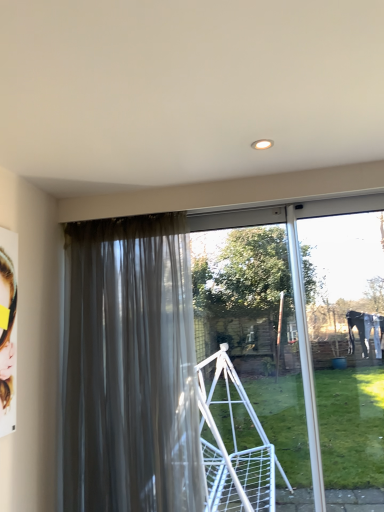
Question: Looking at their shapes, would you say satin gray curtain at left is wider or thinner than clear glass screen door at center?

Choices:
 (A) thin
 (B) wide

Answer: (B)

Question: Does point (134, 345) appear closer or farther from the camera than point (251, 239)?

Choices:
 (A) farther
 (B) closer

Answer: (B)

Question: Is satin gray curtain at left inside or outside of clear glass screen door at center?

Choices:
 (A) outside
 (B) inside

Answer: (A)

Question: Is clear glass screen door at center inside the boundaries of satin gray curtain at left, or outside?

Choices:
 (A) outside
 (B) inside

Answer: (A)

Question: Based on their positions, is clear glass screen door at center located to the left or right of satin gray curtain at left?

Choices:
 (A) left
 (B) right

Answer: (B)

Question: Considering the positions of clear glass screen door at center and satin gray curtain at left in the image, is clear glass screen door at center wider or thinner than satin gray curtain at left?

Choices:
 (A) wide
 (B) thin

Answer: (B)

Question: In terms of size, does clear glass screen door at center appear bigger or smaller than satin gray curtain at left?

Choices:
 (A) big
 (B) small

Answer: (B)